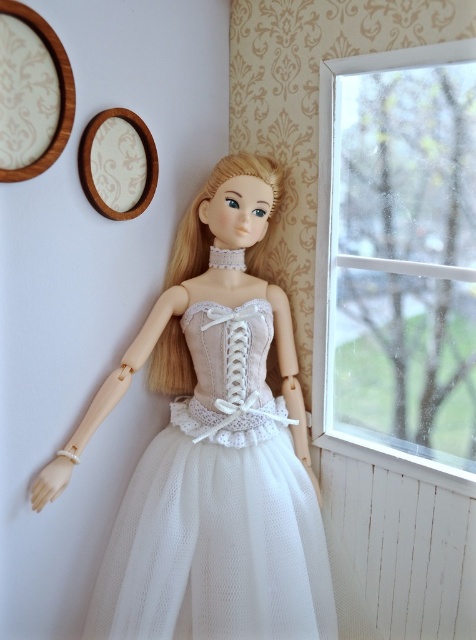
Question: Does transparent glass window at right appear on the right side of white wood at lower right?

Choices:
 (A) yes
 (B) no

Answer: (B)

Question: Which of the following is the closest to the observer?

Choices:
 (A) white wood at lower right
 (B) white tulle dress at center
 (C) transparent glass window at right

Answer: (C)

Question: Is transparent glass window at right positioned at the back of white wood at lower right?

Choices:
 (A) yes
 (B) no

Answer: (B)

Question: Does transparent glass window at right appear over white wood at lower right?

Choices:
 (A) yes
 (B) no

Answer: (A)

Question: Which object appears closest to the camera in this image?

Choices:
 (A) white wood at lower right
 (B) white tulle dress at center

Answer: (B)

Question: Which is nearer to the transparent glass window at right?

Choices:
 (A) white wood at lower right
 (B) white tulle dress at center

Answer: (A)